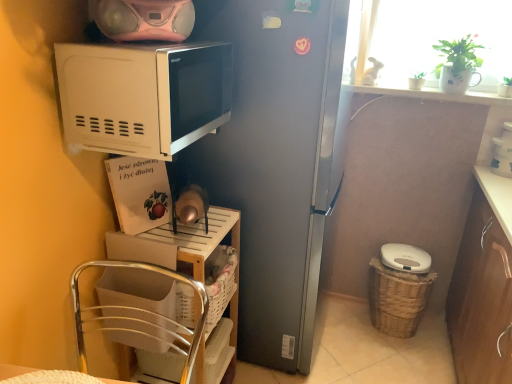
Locate an element on the screen. This screenshot has height=384, width=512. vacant area on top of woven brown basket at lower right, which appears as the first basket when viewed from the right (from a real-world perspective) is located at coordinates (398, 270).